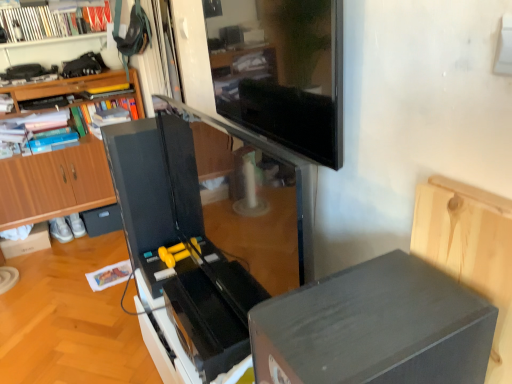
Question: From a real-world perspective, is matte black treadmill at center positioned over wooden bookcase at left based on gravity?

Choices:
 (A) no
 (B) yes

Answer: (B)

Question: From the image's perspective, would you say matte black treadmill at center is shown under wooden bookcase at left?

Choices:
 (A) yes
 (B) no

Answer: (A)

Question: Does matte black treadmill at center have a greater width compared to wooden bookcase at left?

Choices:
 (A) yes
 (B) no

Answer: (B)

Question: Is matte black treadmill at center at the left side of wooden bookcase at left?

Choices:
 (A) yes
 (B) no

Answer: (B)

Question: Is matte black treadmill at center turned away from wooden bookcase at left?

Choices:
 (A) yes
 (B) no

Answer: (B)

Question: Is matte black treadmill at center not near wooden bookcase at left?

Choices:
 (A) yes
 (B) no

Answer: (A)

Question: Can you confirm if white cardboard box at lower left is wider than white glossy bookshelf at upper left?

Choices:
 (A) yes
 (B) no

Answer: (A)

Question: Could you tell me if white cardboard box at lower left is facing white glossy bookshelf at upper left?

Choices:
 (A) yes
 (B) no

Answer: (B)

Question: Is white cardboard box at lower left surrounding white glossy bookshelf at upper left?

Choices:
 (A) yes
 (B) no

Answer: (B)

Question: From a real-world perspective, is white cardboard box at lower left located beneath white glossy bookshelf at upper left?

Choices:
 (A) yes
 (B) no

Answer: (A)

Question: Is the position of white cardboard box at lower left more distant than that of white glossy bookshelf at upper left?

Choices:
 (A) yes
 (B) no

Answer: (A)

Question: Can you confirm if white cardboard box at lower left is smaller than white glossy bookshelf at upper left?

Choices:
 (A) no
 (B) yes

Answer: (B)

Question: From the image's perspective, is matte black tv at upper center above matte black drawer at lower left?

Choices:
 (A) no
 (B) yes

Answer: (B)